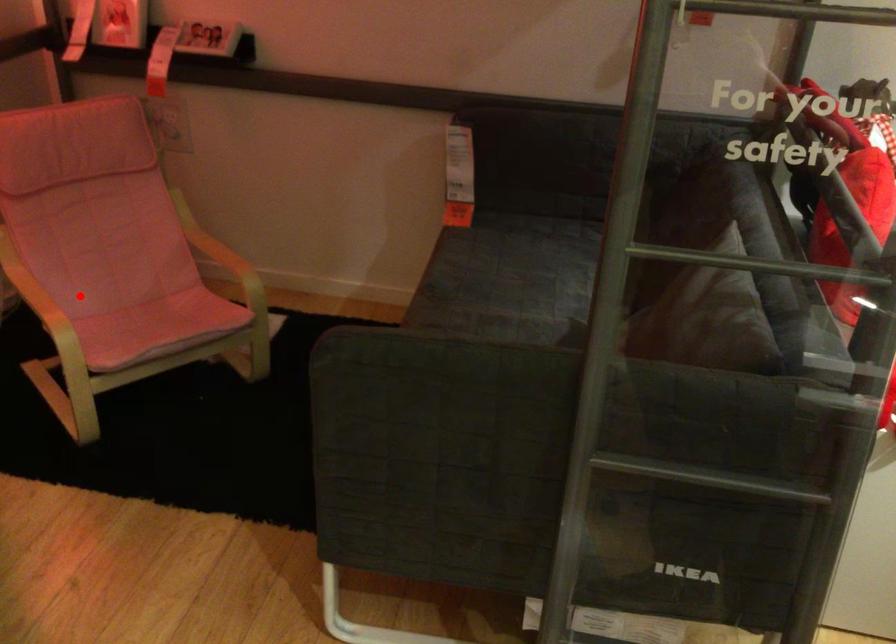
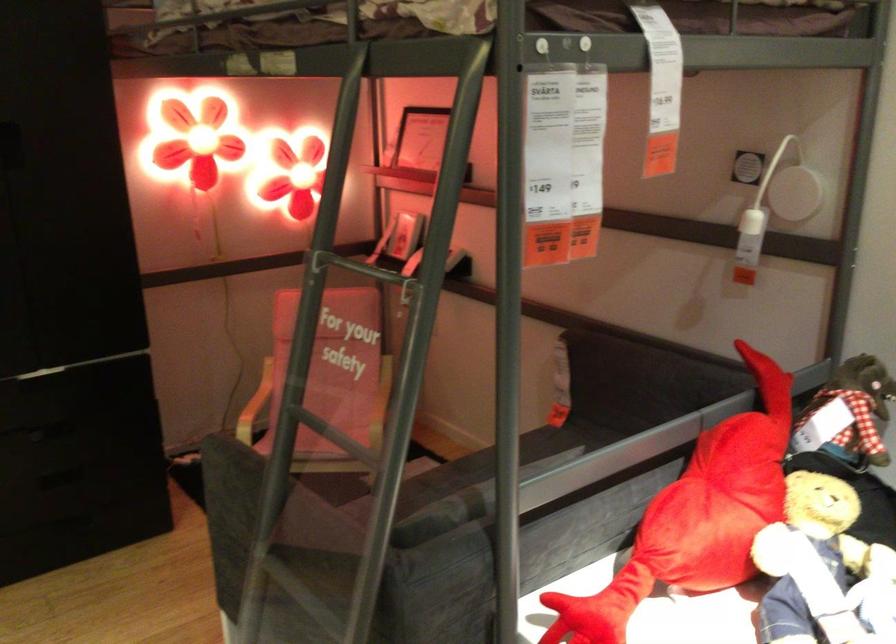
The point at the highlighted location is marked in the first image. Where is the corresponding point in the second image?

(252, 406)